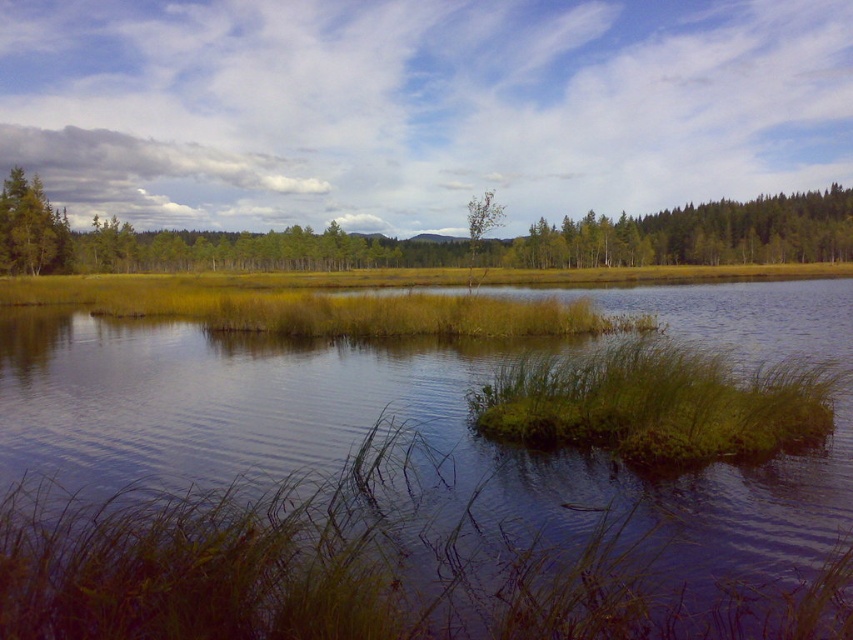
Can you confirm if green grassy forest at upper left is shorter than green leafy grass at center?

No, green grassy forest at upper left is not shorter than green leafy grass at center.

What do you see at coordinates (190, 243) in the screenshot? This screenshot has height=640, width=853. I see `green grassy forest at upper left` at bounding box center [190, 243].

Between point (840, 189) and point (524, 380), which one is positioned in front?

Positioned in front is point (524, 380).

This screenshot has width=853, height=640. Identify the location of green grassy forest at upper left. 190,243.

Is green grassy forest at upper left closer to camera compared to green grass at center?

That is False.

Is point (50, 268) behind point (434, 321)?

Yes, point (50, 268) is behind point (434, 321).

The height and width of the screenshot is (640, 853). Find the location of `green grassy forest at upper left`. green grassy forest at upper left is located at coordinates (190, 243).

Does green matte trees at upper right appear over green matte tree at left?

Correct, green matte trees at upper right is located above green matte tree at left.

Between green matte trees at upper right and green matte tree at left, which one has less height?

green matte tree at left

The image size is (853, 640). Describe the element at coordinates (700, 234) in the screenshot. I see `green matte trees at upper right` at that location.

The width and height of the screenshot is (853, 640). I want to click on green matte trees at upper right, so pos(700,234).